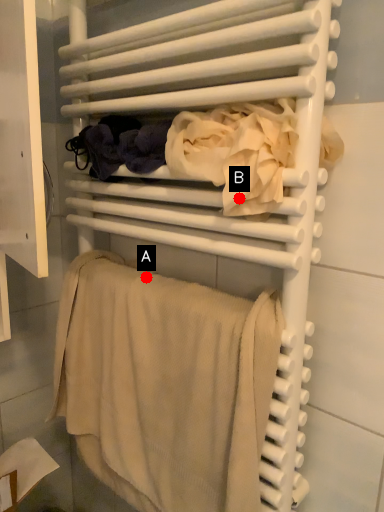
Question: Two points are circled on the image, labeled by A and B beside each circle. Which point is closer to the camera?

Choices:
 (A) A is closer
 (B) B is closer

Answer: (B)